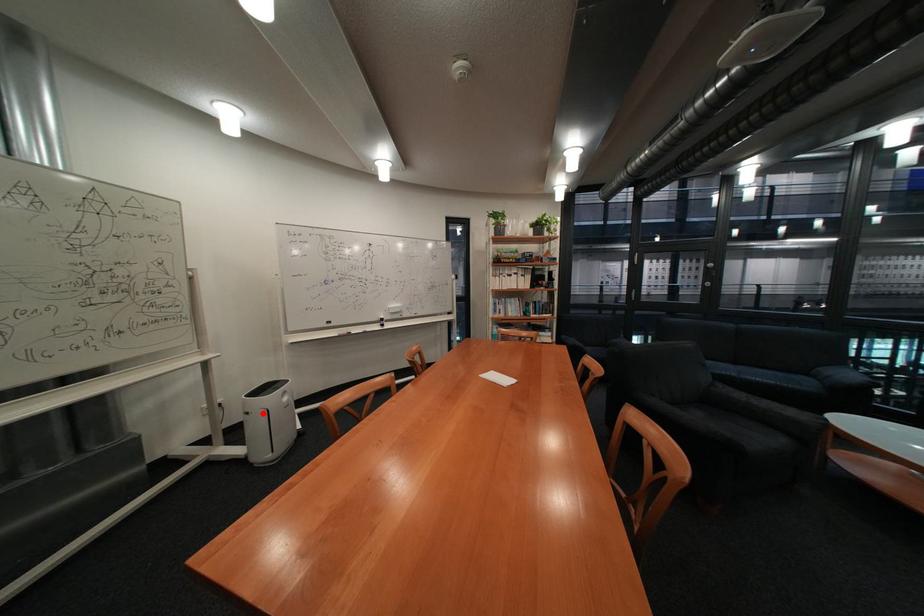
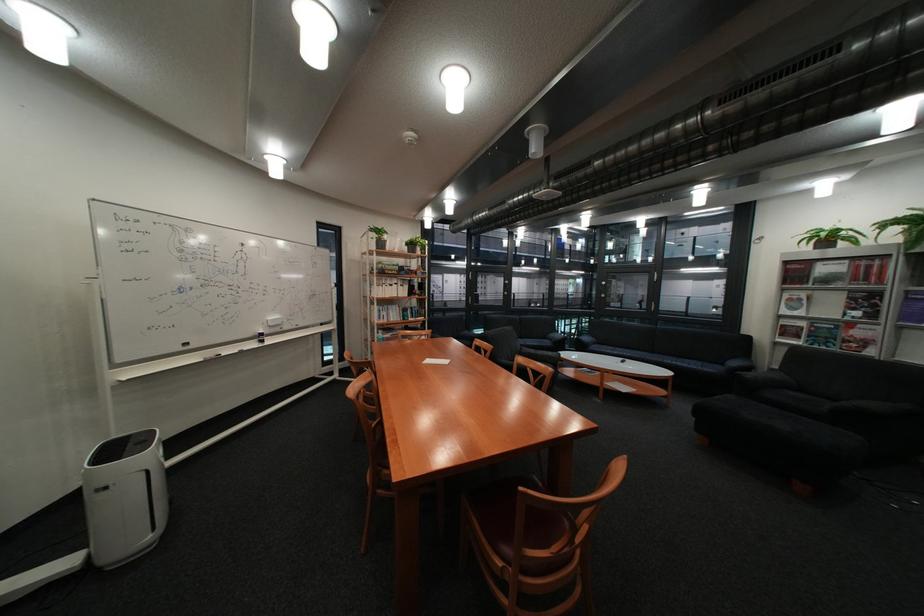
The point at the highlighted location is marked in the first image. Where is the corresponding point in the second image?

(120, 488)